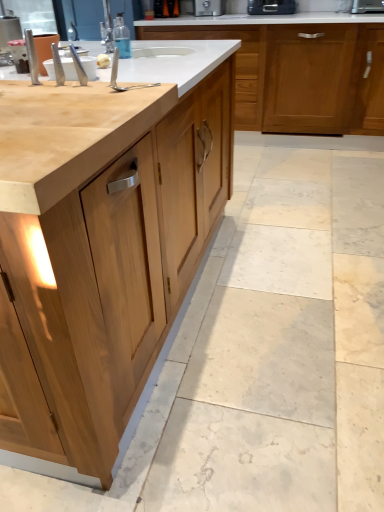
Question: From a real-world perspective, is black plastic toaster at upper center, which ranks as the 1th appliance in left-to-right order, on metallic silver toaster at upper right, which is the second appliance in left-to-right order?

Choices:
 (A) no
 (B) yes

Answer: (B)

Question: From the image's perspective, is black plastic toaster at upper center, marked as the 2th appliance in a right-to-left arrangement, located beneath metallic silver toaster at upper right, which is the second appliance in left-to-right order?

Choices:
 (A) no
 (B) yes

Answer: (A)

Question: Can you confirm if black plastic toaster at upper center, marked as the 2th appliance in a right-to-left arrangement, is shorter than metallic silver toaster at upper right, the 1th appliance in the right-to-left sequence?

Choices:
 (A) no
 (B) yes

Answer: (A)

Question: Is metallic silver toaster at upper right, which is the second appliance in left-to-right order, at the back of black plastic toaster at upper center, marked as the 2th appliance in a right-to-left arrangement?

Choices:
 (A) yes
 (B) no

Answer: (B)

Question: Is black plastic toaster at upper center, marked as the 2th appliance in a right-to-left arrangement, not inside metallic silver toaster at upper right, which is the second appliance in left-to-right order?

Choices:
 (A) no
 (B) yes

Answer: (B)

Question: Does black plastic toaster at upper center, which ranks as the 1th appliance in left-to-right order, have a smaller size compared to metallic silver toaster at upper right, the 1th appliance in the right-to-left sequence?

Choices:
 (A) yes
 (B) no

Answer: (B)

Question: Is natural wood cabinet at center, which is counted as the 2th cabinetry, starting from the back, in front of metallic silver toaster at upper right, the 1th appliance in the right-to-left sequence?

Choices:
 (A) yes
 (B) no

Answer: (A)

Question: From the image's perspective, is natural wood cabinet at center, which is the 1th cabinetry in front-to-back order, below metallic silver toaster at upper right, the 1th appliance in the right-to-left sequence?

Choices:
 (A) no
 (B) yes

Answer: (B)

Question: Does natural wood cabinet at center, which is counted as the 2th cabinetry, starting from the back, have a smaller size compared to metallic silver toaster at upper right, which is the second appliance in left-to-right order?

Choices:
 (A) no
 (B) yes

Answer: (A)

Question: Considering the relative positions of natural wood cabinet at center, which is counted as the 2th cabinetry, starting from the back, and metallic silver toaster at upper right, which is the second appliance in left-to-right order, in the image provided, is natural wood cabinet at center, which is counted as the 2th cabinetry, starting from the back, to the right of metallic silver toaster at upper right, which is the second appliance in left-to-right order, from the viewer's perspective?

Choices:
 (A) no
 (B) yes

Answer: (A)

Question: Can you confirm if natural wood cabinet at center, which is counted as the 2th cabinetry, starting from the back, is thinner than metallic silver toaster at upper right, which is the second appliance in left-to-right order?

Choices:
 (A) no
 (B) yes

Answer: (A)

Question: Is natural wood cabinet at center, which is counted as the 2th cabinetry, starting from the back, positioned far away from metallic silver toaster at upper right, the 1th appliance in the right-to-left sequence?

Choices:
 (A) no
 (B) yes

Answer: (B)

Question: Can you confirm if natural wood cabinet at center, which is the 1th cabinetry in front-to-back order, is bigger than black plastic toaster at upper center, marked as the 2th appliance in a right-to-left arrangement?

Choices:
 (A) yes
 (B) no

Answer: (A)